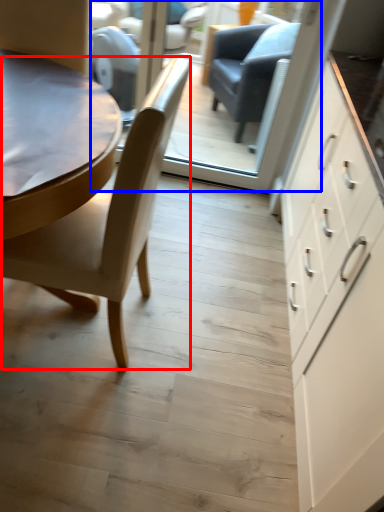
Question: Which object is closer to the camera taking this photo, chair (highlighted by a red box) or glass door (highlighted by a blue box)?

Choices:
 (A) chair
 (B) glass door

Answer: (A)